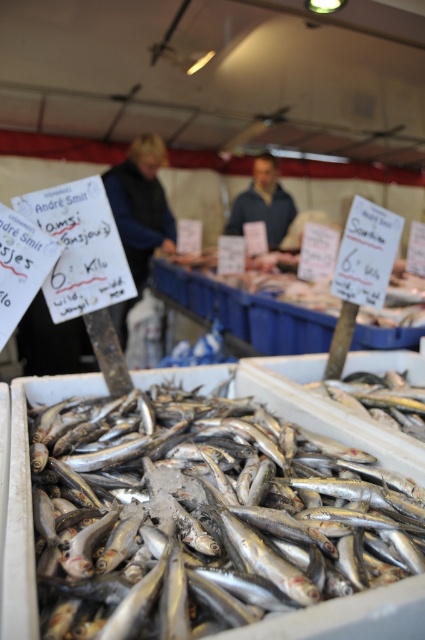
You are at the fish market and want to buy some silvery metallic fish at center. The vendor is standing at point (204,509). Where should you go to find the silvery metallic fish?

The point (204,509) corresponds to the silvery metallic fish at center, so you should go to that point to find them.

You are a photographer standing at the camera position. You want to take a closeup photo of the silvery metallic fish at center. Can you reach it without moving your feet? The average human arm length is about 25 inches.

The silvery metallic fish at center is 26.97 inches away from camera. Since the average human arm length is 25 inches, you cannot reach it without moving your feet.